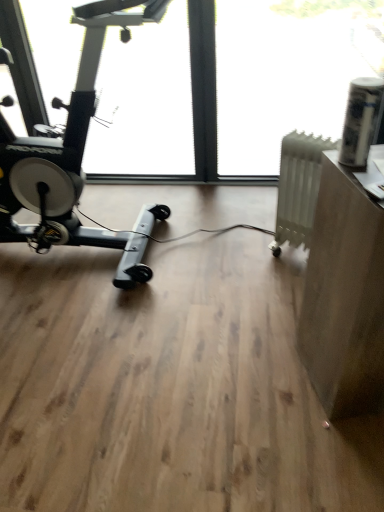
Question: From the image's perspective, is transparent plastic window screen at upper right, the second window screen when ordered from left to right, on top of transparent glass window at center, which is the first window screen from left to right?

Choices:
 (A) yes
 (B) no

Answer: (A)

Question: From a real-world perspective, does transparent plastic window screen at upper right, which appears as the 1th window screen when viewed from the right, stand above transparent glass window at center, which is the first window screen from left to right?

Choices:
 (A) yes
 (B) no

Answer: (B)

Question: Could you tell me if transparent plastic window screen at upper right, the second window screen when ordered from left to right, is turned towards transparent glass window at center, which is the first window screen from left to right?

Choices:
 (A) no
 (B) yes

Answer: (B)

Question: Considering the relative sizes of transparent plastic window screen at upper right, which appears as the 1th window screen when viewed from the right, and transparent glass window at center, which is the first window screen from left to right, in the image provided, is transparent plastic window screen at upper right, which appears as the 1th window screen when viewed from the right, taller than transparent glass window at center, which is the first window screen from left to right,?

Choices:
 (A) yes
 (B) no

Answer: (B)

Question: Is transparent plastic window screen at upper right, which appears as the 1th window screen when viewed from the right, with transparent glass window at center, the 2th window screen when ordered from right to left?

Choices:
 (A) no
 (B) yes

Answer: (B)

Question: From a real-world perspective, is transparent glass window at center, which is the first window screen from left to right, physically located above or below transparent plastic window screen at upper right, the second window screen when ordered from left to right?

Choices:
 (A) below
 (B) above

Answer: (B)

Question: From the image's perspective, relative to transparent plastic window screen at upper right, which appears as the 1th window screen when viewed from the right, is transparent glass window at center, the 2th window screen when ordered from right to left, above or below?

Choices:
 (A) above
 (B) below

Answer: (B)

Question: Is point (145, 139) closer or farther from the camera than point (332, 74)?

Choices:
 (A) farther
 (B) closer

Answer: (A)

Question: Based on their sizes in the image, would you say transparent glass window at center, the 2th window screen when ordered from right to left, is bigger or smaller than transparent plastic window screen at upper right, the second window screen when ordered from left to right?

Choices:
 (A) small
 (B) big

Answer: (B)

Question: From a real-world perspective, is matte brown desk at right above or below white matte radiator at right?

Choices:
 (A) above
 (B) below

Answer: (A)

Question: In the image, is matte brown desk at right on the left side or the right side of white matte radiator at right?

Choices:
 (A) right
 (B) left

Answer: (A)

Question: Based on their sizes in the image, would you say matte brown desk at right is bigger or smaller than white matte radiator at right?

Choices:
 (A) big
 (B) small

Answer: (A)

Question: Is matte brown desk at right situated inside white matte radiator at right or outside?

Choices:
 (A) inside
 (B) outside

Answer: (B)

Question: From a real-world perspective, is matte brown desk at right physically located above or below transparent plastic window screen at upper right, which appears as the 1th window screen when viewed from the right?

Choices:
 (A) below
 (B) above

Answer: (A)

Question: In the image, is matte brown desk at right positioned in front of or behind transparent plastic window screen at upper right, the second window screen when ordered from left to right?

Choices:
 (A) front
 (B) behind

Answer: (A)